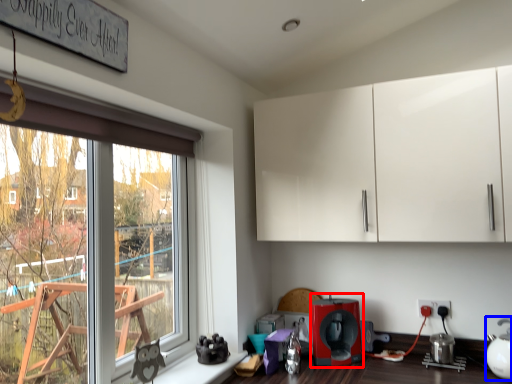
Question: Among these objects, which one is farthest to the camera, coffee machine (highlighted by a red box) or tea pot (highlighted by a blue box)?

Choices:
 (A) coffee machine
 (B) tea pot

Answer: (A)